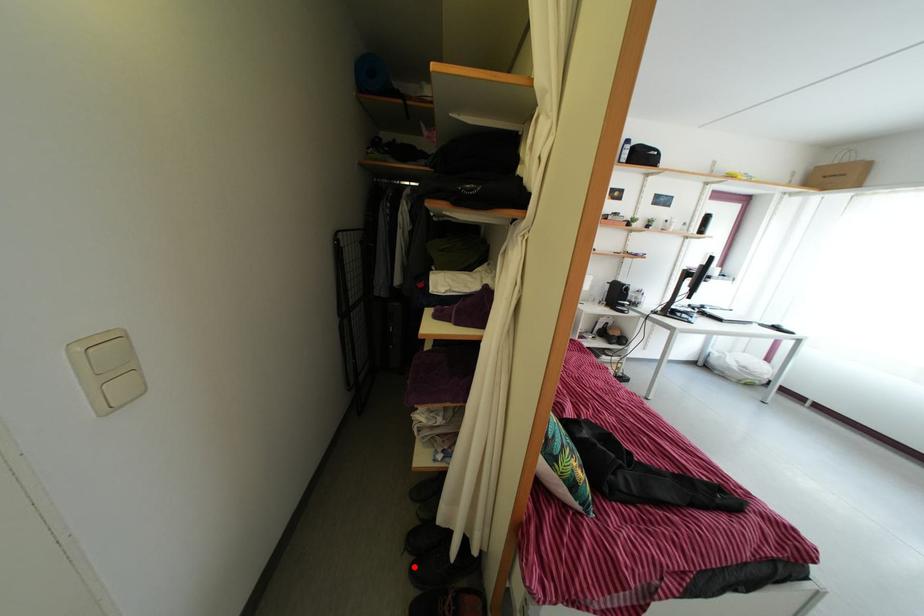
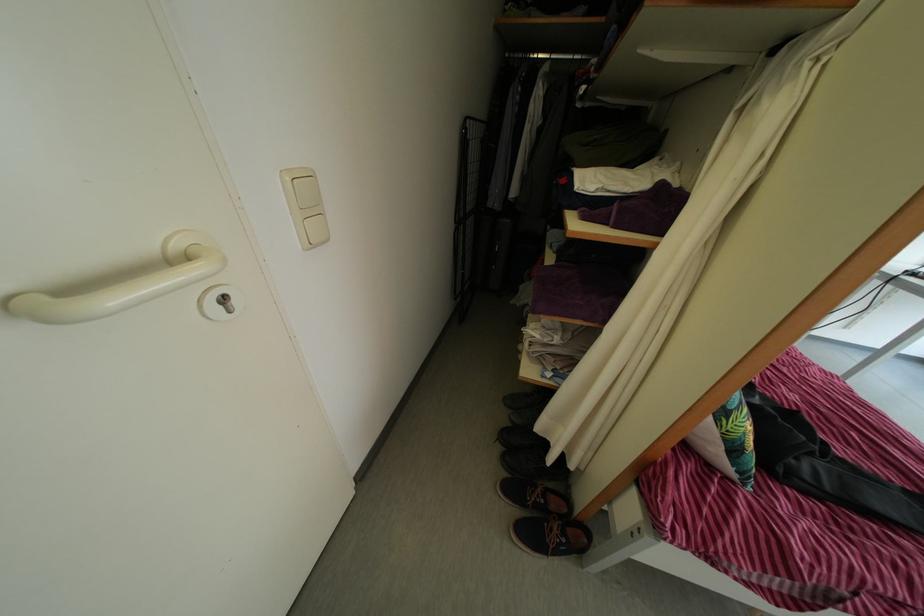
Question: I am providing you with two images of the same scene from different viewpoints. A red point is shown in image1. For the corresponding object point in image2, is it positioned nearer or farther from the camera?

Choices:
 (A) Nearer
 (B) Farther

Answer: (A)